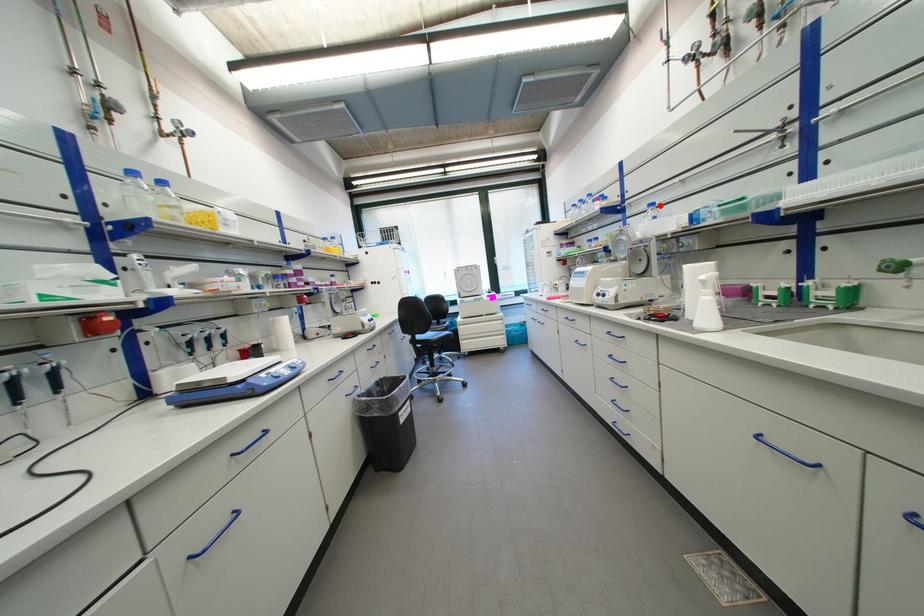
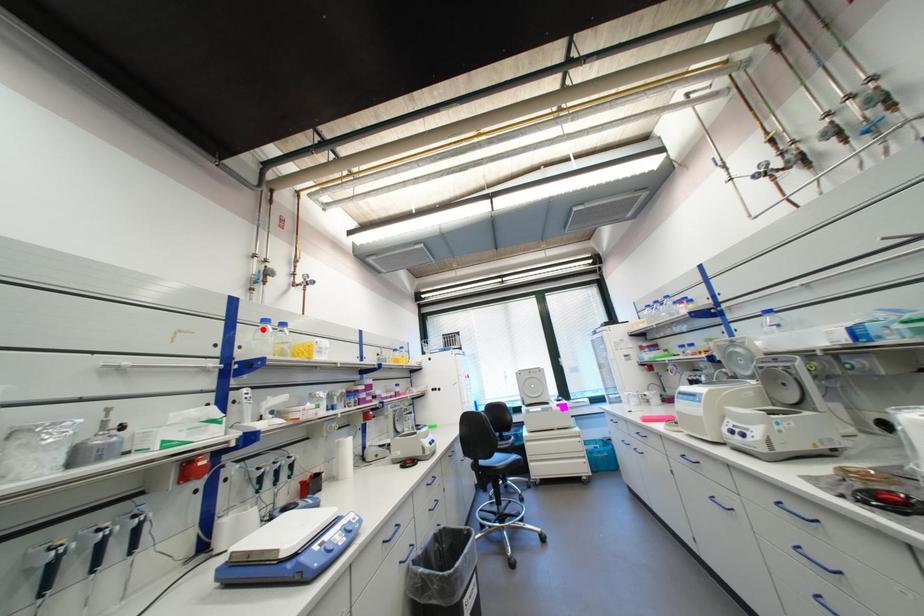
I am providing you with two images of the same scene from different viewpoints. A red point is marked on the first image and another point is marked on the second image. Are the points marked in image1 and image2 representing the same 3D position?

No